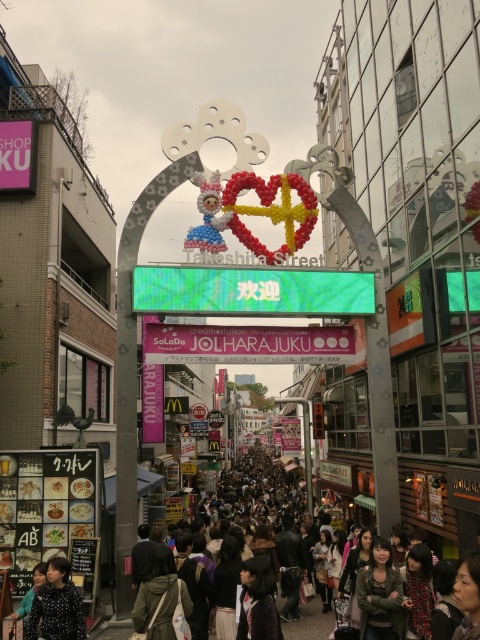
You are standing at the entrance of Takeshita Street and see two points marked on the ground. The first point is at coordinates point (153,275) and the second is at point (377,563). Which point is closer to you?

Point (153,275) is further to the camera than point (377,563), so the point closer to you is point (377,563).

You are standing at the entrance of Takeshita Street and see a point marked at coordinates [248,342]. According to the scene description, what object is this point located on?

The point at [248,342] is located on the pink fabric banner at center.

You are a street performer planning to set up a booth between the pink fabric banner at center and the polka dot blouse at lower left. Considering the space available, which object provides more horizontal space for your setup?

The pink fabric banner at center provides more horizontal space for your setup because its width surpasses that of the polka dot blouse at lower left.